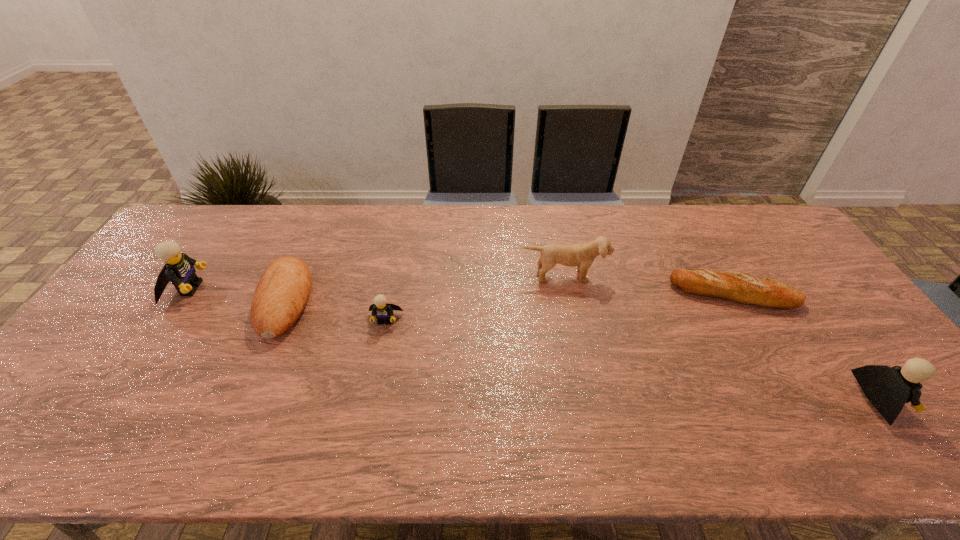
The image size is (960, 540). What are the coordinates of `vacant space that satisfies the following two spatial constraints: 1. on the left side of the puppy; 2. on the right side of the baguet` in the screenshot? It's located at (567, 294).

Image resolution: width=960 pixels, height=540 pixels. Identify the location of vacant region that satisfies the following two spatial constraints: 1. on the left side of the puppy; 2. on the front-facing side of the farthest Lego. (566, 288).